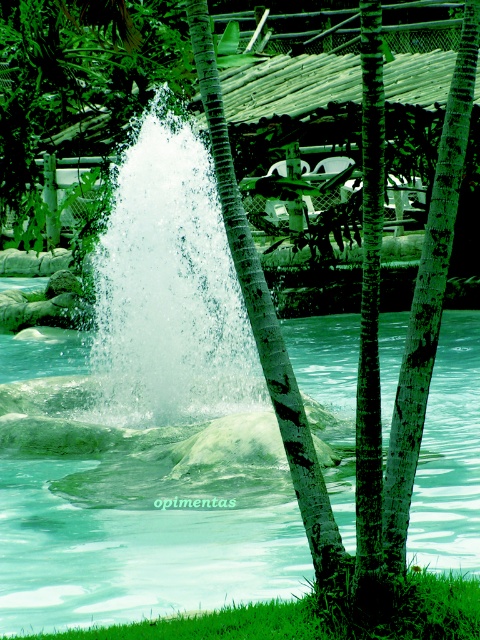
From the picture: Who is higher up, clear water pool at center or white frothy water at center?

white frothy water at center

Does clear water pool at center have a larger size compared to white frothy water at center?

Correct, clear water pool at center is larger in size than white frothy water at center.

Measure the distance between point (120,492) and camera.

Point (120,492) is 28.89 feet away from camera.

I want to click on clear water pool at center, so click(140, 540).